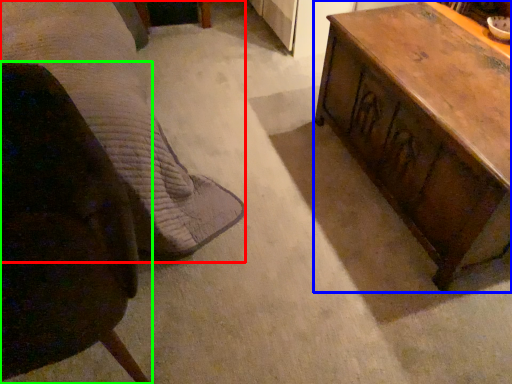
Question: Which object is the farthest from bed (highlighted by a red box)? Choose among these: table (highlighted by a blue box) or chair (highlighted by a green box).

Choices:
 (A) table
 (B) chair

Answer: (A)